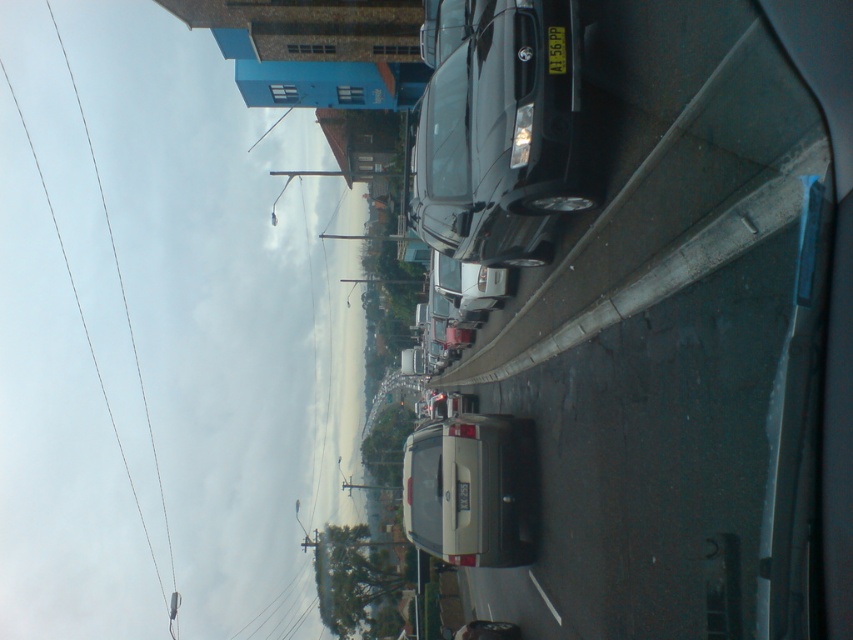
You are a delivery driver who needs to park your vehicle between the shiny black car at center and the matte silver van at center. Given that your delivery van is 2.5 meters wide, can you fit it between them?

The shiny black car at center is wider than the matte silver van at center. However, without knowing the exact distance between them, it is impossible to determine if your 2.5 meter wide van can fit. Please check the space between them first.

You are driving a car and looking through the windshield. You see a matte silver van at center and a black plastic license plate at center. Which object is closer to you?

The matte silver van at center is closer to you because it is positioned under the black plastic license plate at center, meaning it is in front of the license plate.

You are a delivery person trying to decide which vehicle to load packages into. The shiny black car at center and the matte silver van at center are both available. Which vehicle has more vertical space inside for taller items?

The shiny black car at center has a greater height compared to the matte silver van at center, so it has more vertical space inside for taller items.